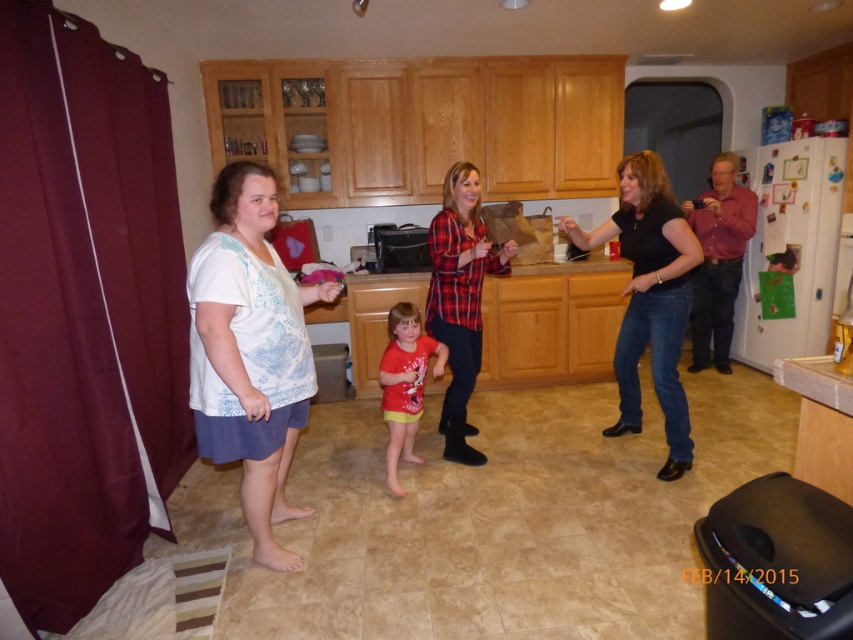
Question: Which object is closer to the camera taking this photo?

Choices:
 (A) white cotton shirt at left
 (B) matte red shirt at center
 (C) white printed blouse at center
 (D) black matte shirt at center

Answer: (C)

Question: Which object is closer to the camera taking this photo?

Choices:
 (A) white cotton shirt at left
 (B) black matte shirt at center
 (C) matte red shirt at center
 (D) plaid fabric shirt at center

Answer: (A)

Question: Considering the relative positions of black matte shirt at center and plaid fabric shirt at center in the image provided, where is black matte shirt at center located with respect to plaid fabric shirt at center?

Choices:
 (A) above
 (B) below

Answer: (A)

Question: Does white printed blouse at center have a lesser width compared to black matte shirt at center?

Choices:
 (A) no
 (B) yes

Answer: (B)

Question: Which object is farther from the camera taking this photo?

Choices:
 (A) white cotton shirt at left
 (B) black matte shirt at center

Answer: (B)

Question: Can you confirm if white printed blouse at center is positioned to the right of black matte shirt at center?

Choices:
 (A) yes
 (B) no

Answer: (B)